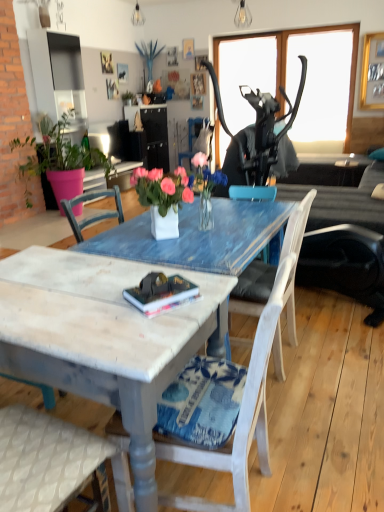
Question: Considering the relative positions of matte black lampshade at upper center, which is the second lamp in front-to-back order, and white painted wood chair at center, acting as the first chair starting from the bottom, in the image provided, is matte black lampshade at upper center, which is the second lamp in front-to-back order, to the left of white painted wood chair at center, acting as the first chair starting from the bottom, from the viewer's perspective?

Choices:
 (A) yes
 (B) no

Answer: (A)

Question: From a real-world perspective, is matte black lampshade at upper center, acting as the 1th lamp starting from the back, beneath white painted wood chair at center, the 1th chair viewed from the front?

Choices:
 (A) yes
 (B) no

Answer: (B)

Question: Does matte black lampshade at upper center, acting as the 1th lamp starting from the top, appear on the right side of white painted wood chair at center, the 1th chair viewed from the front?

Choices:
 (A) yes
 (B) no

Answer: (B)

Question: Is matte black lampshade at upper center, which is the second lamp in front-to-back order, completely or partially outside of white painted wood chair at center, the 3th chair in the back-to-front sequence?

Choices:
 (A) yes
 (B) no

Answer: (A)

Question: Considering the relative positions of matte black lampshade at upper center, which is the second lamp in front-to-back order, and white painted wood chair at center, the 3th chair in the back-to-front sequence, in the image provided, is matte black lampshade at upper center, which is the second lamp in front-to-back order, behind white painted wood chair at center, the 3th chair in the back-to-front sequence,?

Choices:
 (A) no
 (B) yes

Answer: (B)

Question: From the image's perspective, is matte black side table at right positioned above or below transparent glass window screen at upper right?

Choices:
 (A) above
 (B) below

Answer: (B)

Question: Visually, is matte black side table at right positioned to the left or to the right of transparent glass window screen at upper right?

Choices:
 (A) left
 (B) right

Answer: (B)

Question: Considering the positions of point pos(350,166) and point pos(329,77), is point pos(350,166) closer or farther from the camera than point pos(329,77)?

Choices:
 (A) closer
 (B) farther

Answer: (A)

Question: From their relative heights in the image, would you say matte black side table at right is taller or shorter than transparent glass window screen at upper right?

Choices:
 (A) tall
 (B) short

Answer: (B)

Question: Considering their positions, is white painted wood chair at center, which is the 3th chair from top to bottom, located in front of or behind white wood chair at center, the 3th chair positioned from the front?

Choices:
 (A) front
 (B) behind

Answer: (A)

Question: From a real-world perspective, relative to white wood chair at center, the third chair in the bottom-to-top sequence, is white painted wood chair at center, the 1th chair viewed from the front, vertically above or below?

Choices:
 (A) above
 (B) below

Answer: (B)

Question: From the image's perspective, is white painted wood chair at center, the 1th chair viewed from the front, located above or below white wood chair at center, the 3th chair positioned from the front?

Choices:
 (A) below
 (B) above

Answer: (A)

Question: Based on their sizes in the image, would you say white painted wood chair at center, the 3th chair in the back-to-front sequence, is bigger or smaller than white wood chair at center, the 3th chair positioned from the front?

Choices:
 (A) small
 (B) big

Answer: (A)

Question: Based on their sizes in the image, would you say matte black side table at right is bigger or smaller than dark gray fabric couch at center?

Choices:
 (A) big
 (B) small

Answer: (B)

Question: Looking at their shapes, would you say matte black side table at right is wider or thinner than dark gray fabric couch at center?

Choices:
 (A) wide
 (B) thin

Answer: (B)